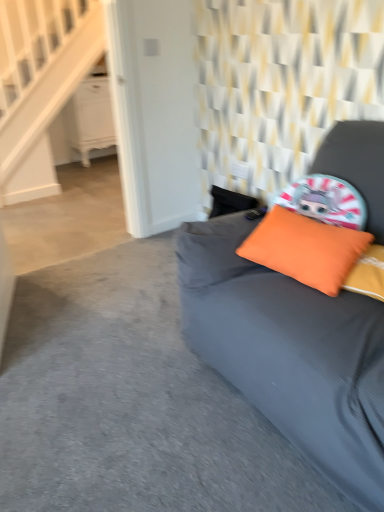
Question: Are orange fabric pillow at upper right and white wood stairwell at upper left beside each other?

Choices:
 (A) no
 (B) yes

Answer: (A)

Question: Is orange fabric pillow at upper right not close to white wood stairwell at upper left?

Choices:
 (A) yes
 (B) no

Answer: (A)

Question: Is orange fabric pillow at upper right wider than white wood stairwell at upper left?

Choices:
 (A) yes
 (B) no

Answer: (A)

Question: From the image's perspective, would you say orange fabric pillow at upper right is shown under white wood stairwell at upper left?

Choices:
 (A) yes
 (B) no

Answer: (A)

Question: Can you confirm if orange fabric pillow at upper right is taller than white wood stairwell at upper left?

Choices:
 (A) yes
 (B) no

Answer: (B)

Question: Can white wood stairwell at upper left be found inside orange fabric pillow at upper right?

Choices:
 (A) yes
 (B) no

Answer: (B)

Question: Is white wood stairwell at upper left smaller than white glossy dresser at upper left?

Choices:
 (A) yes
 (B) no

Answer: (A)

Question: Does white wood stairwell at upper left have a larger size compared to white glossy dresser at upper left?

Choices:
 (A) no
 (B) yes

Answer: (A)

Question: Does white wood stairwell at upper left come behind white glossy dresser at upper left?

Choices:
 (A) yes
 (B) no

Answer: (B)

Question: Is white wood stairwell at upper left shorter than white glossy dresser at upper left?

Choices:
 (A) no
 (B) yes

Answer: (A)

Question: Would you say white wood stairwell at upper left is outside white glossy dresser at upper left?

Choices:
 (A) no
 (B) yes

Answer: (B)

Question: Is white glossy dresser at upper left completely or partially inside white wood stairwell at upper left?

Choices:
 (A) yes
 (B) no

Answer: (B)

Question: From the image's perspective, would you say matte gray studio couch at center is positioned over orange fabric pillow at upper right?

Choices:
 (A) no
 (B) yes

Answer: (A)